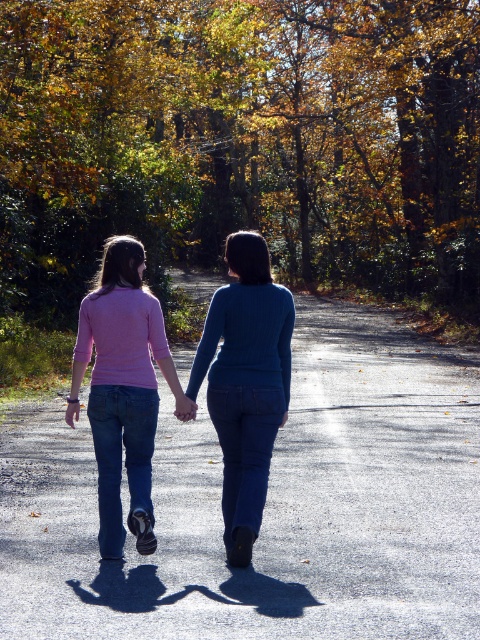
Question: Which point appears farthest from the camera in this image?

Choices:
 (A) (372, 36)
 (B) (264, 316)

Answer: (A)

Question: From the image, what is the correct spatial relationship of autumn leaves at center in relation to asphalt road at center?

Choices:
 (A) below
 (B) above

Answer: (B)

Question: Does asphalt road at center have a smaller size compared to pink matte sweater at center?

Choices:
 (A) yes
 (B) no

Answer: (B)

Question: Which of the following is the closest to the observer?

Choices:
 (A) pink matte sweater at center
 (B) autumn leaves at center

Answer: (A)

Question: Is autumn leaves at center closer to the viewer compared to blue denim jeans at center?

Choices:
 (A) no
 (B) yes

Answer: (A)

Question: Which is nearer to the pink matte sweater at center?

Choices:
 (A) autumn leaves at center
 (B) blue denim jeans at center
 (C) asphalt road at center

Answer: (B)